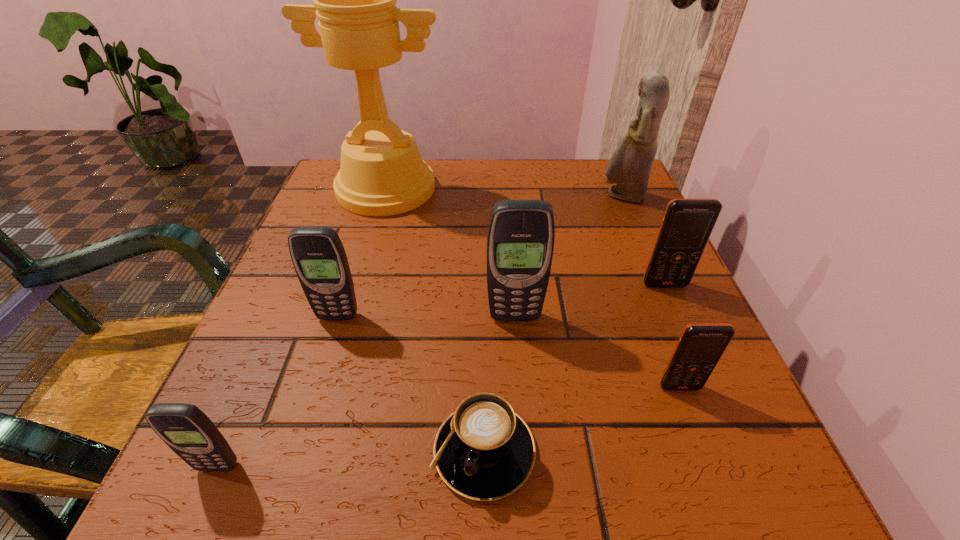
The width and height of the screenshot is (960, 540). I want to click on gray cellular telephone that is the third closest one to the nearer orange cellular telephone, so click(x=189, y=432).

What are the coordinates of `vacant space that satisfies the following two spatial constraints: 1. on the front-facing side of the second tallest object; 2. on the screen of the nearest gray cellular telephone` in the screenshot? It's located at (737, 466).